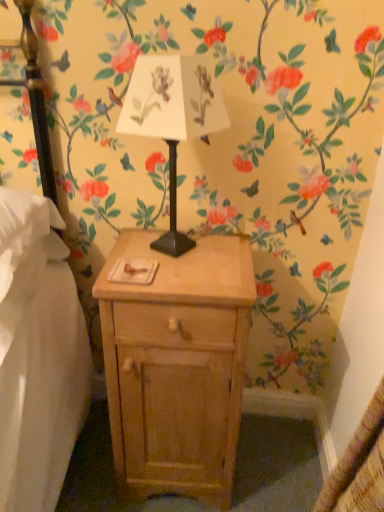
Locate an element on the screen. The image size is (384, 512). free space in front of white paper lampshade at center is located at coordinates (184, 285).